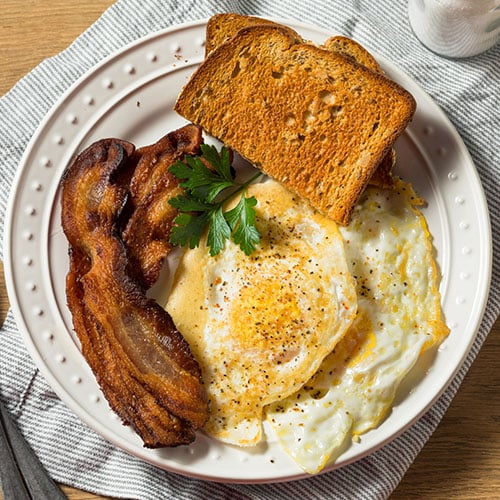
Locate an element on the screen. This screenshot has height=500, width=500. table is located at coordinates (44, 23).